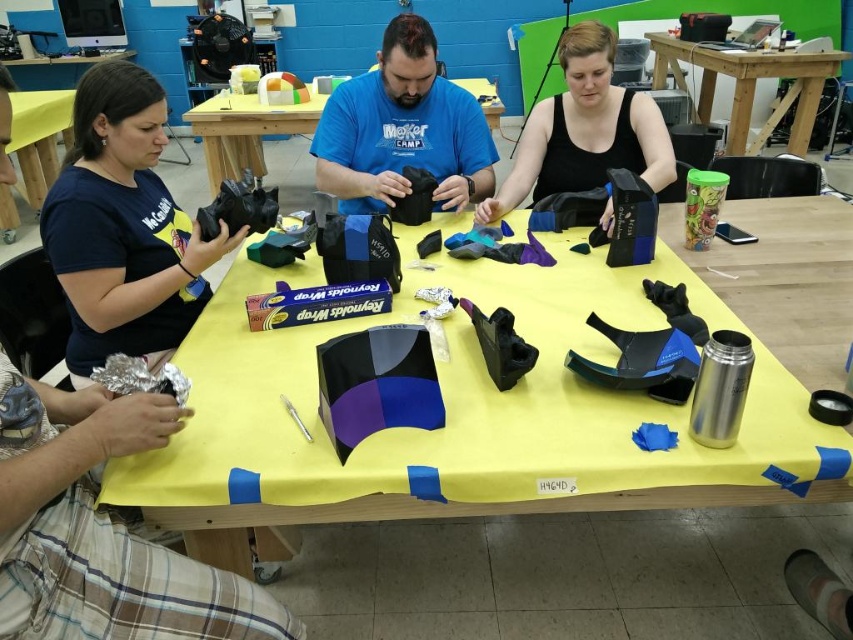
Measure the distance between point (91,99) and camera.

A distance of 4.91 feet exists between point (91,99) and camera.

Which is in front, point (93, 68) or point (692, 58)?

Point (93, 68)

At what (x,y) coordinates should I click in order to perform the action: click on matte black camera at left. Please return your answer as a coordinate pair (x, y). The width and height of the screenshot is (853, 640). Looking at the image, I should click on (123, 227).

Does matte black camera at left have a lesser height compared to yellow fabric at upper left?

A: Indeed, matte black camera at left has a lesser height compared to yellow fabric at upper left.

Which is above, matte black camera at left or yellow fabric at upper left?

Positioned higher is yellow fabric at upper left.

Between point (134, 202) and point (32, 145), which one is positioned in front?

Point (134, 202) is more forward.

At what (x,y) coordinates should I click in order to perform the action: click on matte black camera at left. Please return your answer as a coordinate pair (x, y). The image size is (853, 640). Looking at the image, I should click on (123, 227).

Is matte black fabric at center closer to camera compared to yellow fabric at upper left?

No.

This screenshot has height=640, width=853. What do you see at coordinates (245, 128) in the screenshot?
I see `matte black fabric at center` at bounding box center [245, 128].

Does point (476, 84) lie in front of point (51, 99)?

No, it is behind (51, 99).

At what (x,y) coordinates should I click in order to perform the action: click on matte black fabric at center. Please return your answer as a coordinate pair (x, y). Looking at the image, I should click on (245, 128).